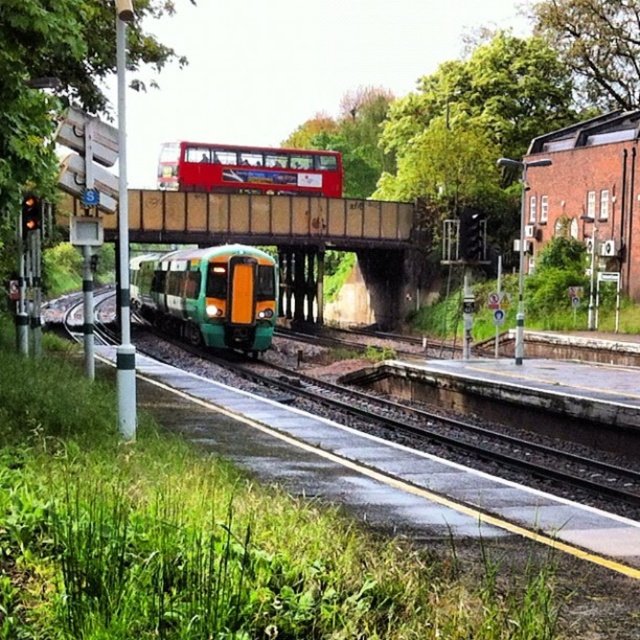
Question: Considering the relative positions of green matte train at center and red rubberized bus at upper center in the image provided, where is green matte train at center located with respect to red rubberized bus at upper center?

Choices:
 (A) above
 (B) below

Answer: (B)

Question: Can you confirm if green matte train at center is positioned above red rubberized bus at upper center?

Choices:
 (A) yes
 (B) no

Answer: (B)

Question: Is green matte train at center thinner than red rubberized bus at upper center?

Choices:
 (A) no
 (B) yes

Answer: (A)

Question: Which of the following is the farthest from the observer?

Choices:
 (A) green matte train at center
 (B) red rubberized bus at upper center

Answer: (B)

Question: Which of the following is the closest to the observer?

Choices:
 (A) (212, 180)
 (B) (182, 262)

Answer: (B)